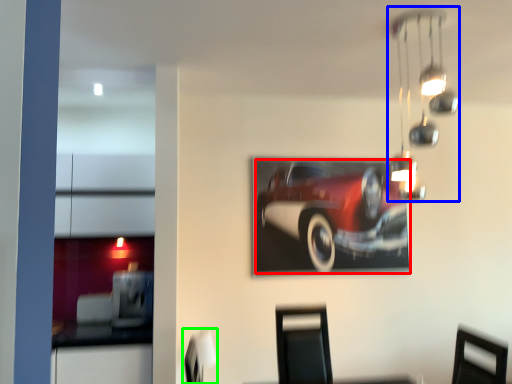
Question: Considering the real-world distances, which object is farthest from car (highlighted by a red box)? lamp (highlighted by a blue box) or swivel chair (highlighted by a green box)?

Choices:
 (A) lamp
 (B) swivel chair

Answer: (B)